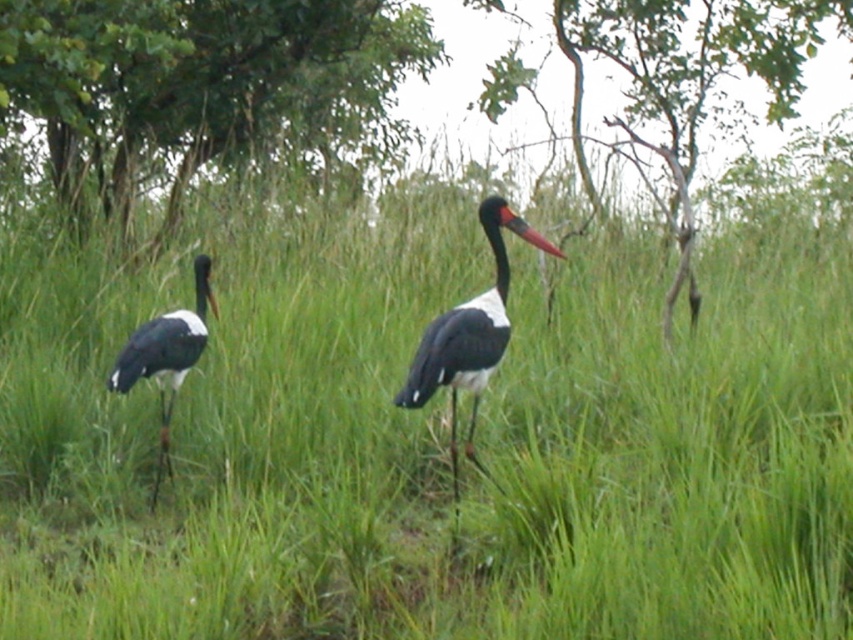
Question: Which point appears closest to the camera in this image?

Choices:
 (A) (674, 4)
 (B) (215, 316)
 (C) (207, 132)
 (D) (467, 387)

Answer: (D)

Question: Considering the relative positions of black glossy stork at center and black glossy stork at left in the image provided, where is black glossy stork at center located with respect to black glossy stork at left?

Choices:
 (A) above
 (B) below

Answer: (A)

Question: Can you confirm if green leafy tree at upper center is positioned to the left of black glossy stork at left?

Choices:
 (A) yes
 (B) no

Answer: (A)

Question: Which point is farther to the camera?

Choices:
 (A) (839, 17)
 (B) (79, 237)

Answer: (A)

Question: Can you confirm if smooth bark tree at upper center is positioned to the right of black glossy stork at center?

Choices:
 (A) no
 (B) yes

Answer: (B)

Question: Which of these objects is positioned closest to the green leafy tree at upper center?

Choices:
 (A) smooth bark tree at upper center
 (B) black glossy stork at center

Answer: (B)